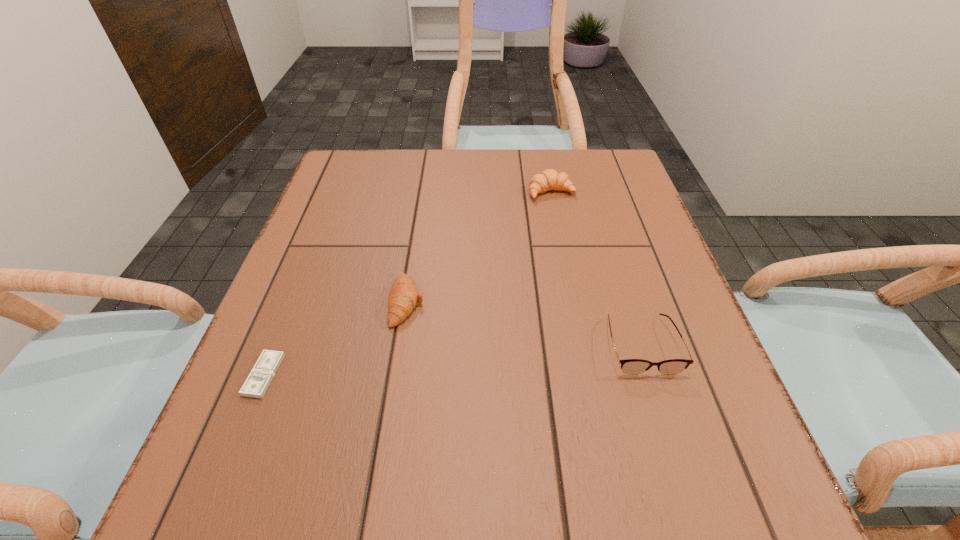
You are a GUI agent. You are given a task and a screenshot of the screen. Output one action in this format:
    pyautogui.click(x=<x>, y=<y>)
    Task: Click on the vacant space in between the nearer crescent roll and the farther crescent roll
    Image resolution: width=960 pixels, height=540 pixels.
    Given the screenshot: What is the action you would take?
    479,247

The height and width of the screenshot is (540, 960). I want to click on vacant space that's between the leftmost object and the left crescent roll, so click(x=336, y=339).

You are a GUI agent. You are given a task and a screenshot of the screen. Output one action in this format:
    pyautogui.click(x=<x>, y=<y>)
    Task: Click on the closest object to the farthest object
    
    Given the screenshot: What is the action you would take?
    pyautogui.click(x=403, y=297)

Image resolution: width=960 pixels, height=540 pixels. Identify the location of object that can be found as the second closest to the second object from left to right. (629, 366).

Locate an element on the screen. The width and height of the screenshot is (960, 540). free space that satisfies the following two spatial constraints: 1. on the back side of the farthest object; 2. on the left side of the shorter crescent roll is located at coordinates (424, 192).